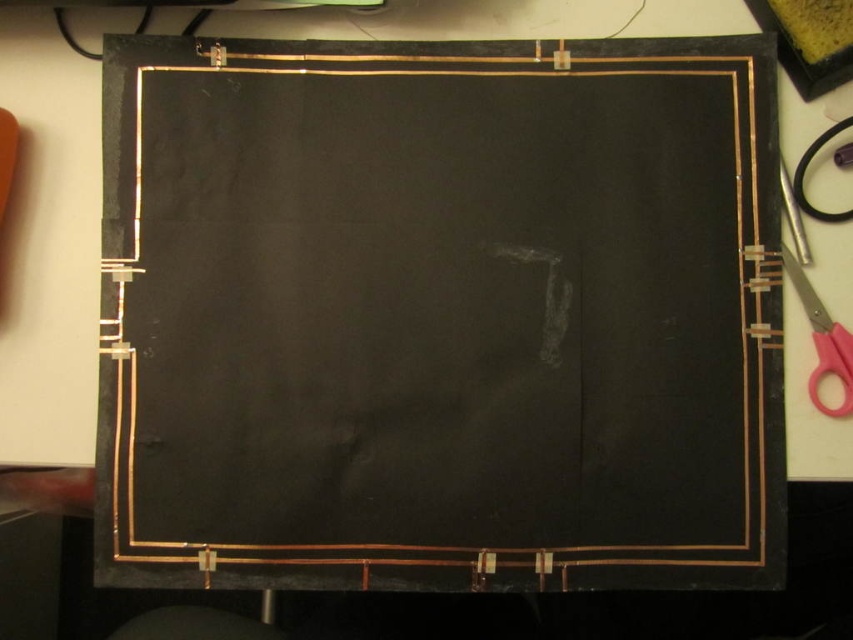
Question: Which point is farther from the camera taking this photo?

Choices:
 (A) pos(822,412)
 (B) pos(607,115)

Answer: (B)

Question: Is black matte board at center positioned in front of pink plastic scissors at right?

Choices:
 (A) yes
 (B) no

Answer: (B)

Question: Which point appears closest to the camera in this image?

Choices:
 (A) (242, 540)
 (B) (788, 259)

Answer: (A)

Question: Is black matte board at center below pink plastic scissors at right?

Choices:
 (A) no
 (B) yes

Answer: (A)

Question: Does black matte board at center have a larger size compared to pink plastic scissors at right?

Choices:
 (A) no
 (B) yes

Answer: (B)